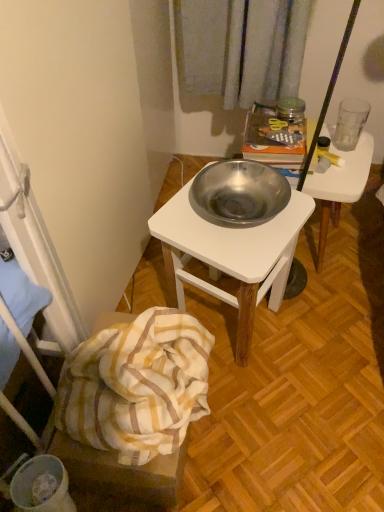
This screenshot has height=512, width=384. Find the location of `vacant region below metallic white desk at center, which is the 2th desk from left to right (from a real-world perspective)`. vacant region below metallic white desk at center, which is the 2th desk from left to right (from a real-world perspective) is located at coordinates (316, 245).